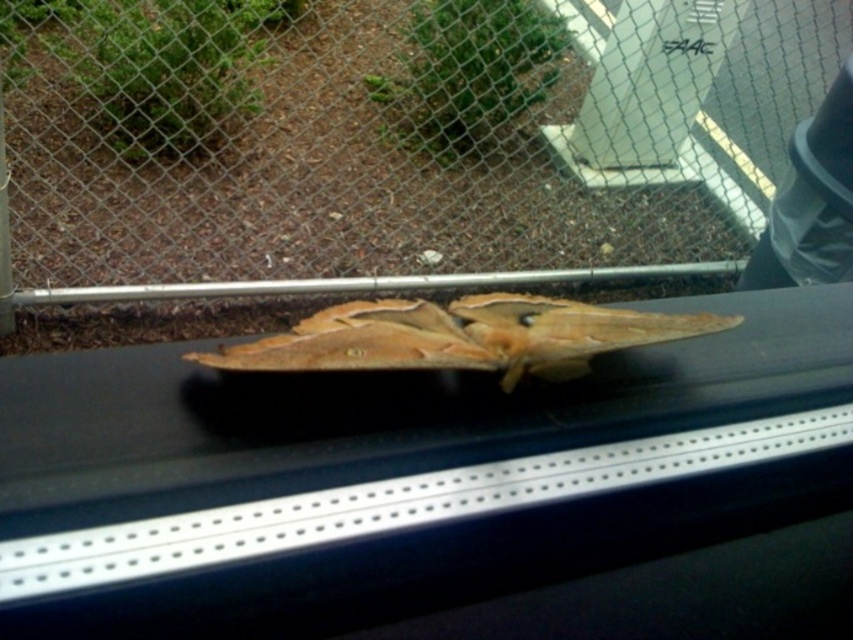
Which of these two, metal chain-link fence at center or brown matte butterfly at center, stands taller?

metal chain-link fence at center is taller.

Can you confirm if metal chain-link fence at center is positioned below brown matte butterfly at center?

No, metal chain-link fence at center is not below brown matte butterfly at center.

Is point (74, 109) closer to viewer compared to point (570, 305)?

No.

Identify the location of metal chain-link fence at center. (427, 150).